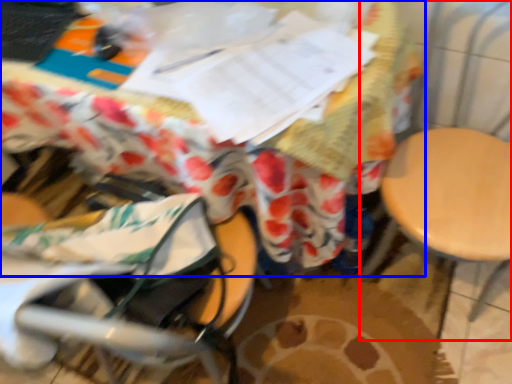
Question: Which object appears farthest to the camera in this image, swivel chair (highlighted by a red box) or table (highlighted by a blue box)?

Choices:
 (A) swivel chair
 (B) table

Answer: (B)